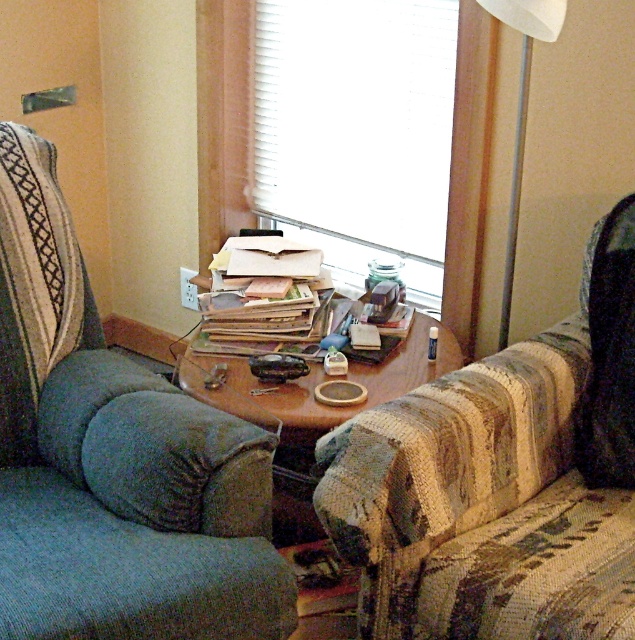
You are organizing a small party and need to place a large centerpiece on the table between the striped fabric couch at center and the white matte window at center. Based on their positions, where should you place the centerpiece so it is centered between them?

The striped fabric couch at center is located below the white matte window at center, so placing the centerpiece in the middle of the table between them would position it directly under the window and above the couch.

Consider the image. You are sitting on the blue fabric swivel chair at left and want to look out the white matte window at center. Can you rotate your chair to face the window without moving your legs?

The blue fabric swivel chair at left is in front of the white matte window at center, so you can rotate your chair to face the window without needing to move your legs.